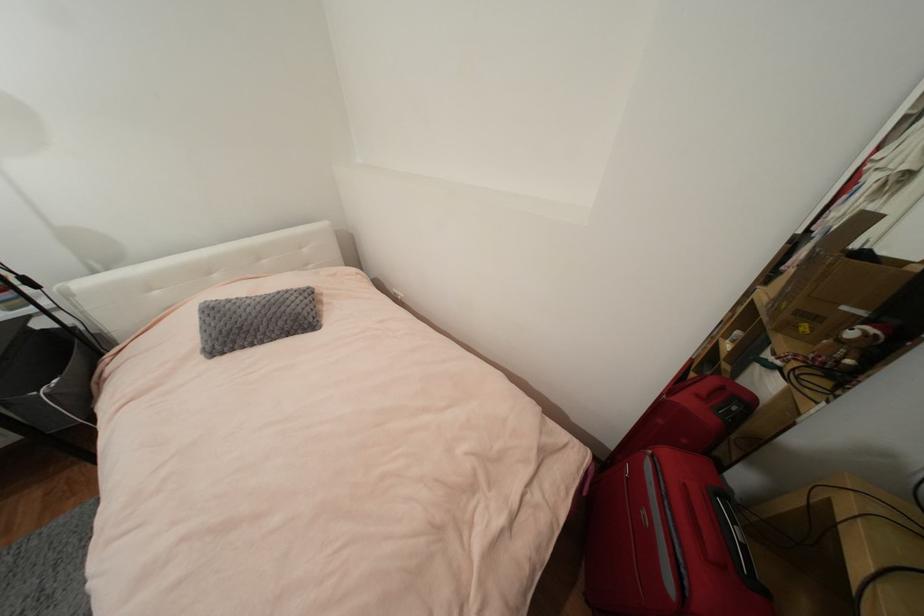
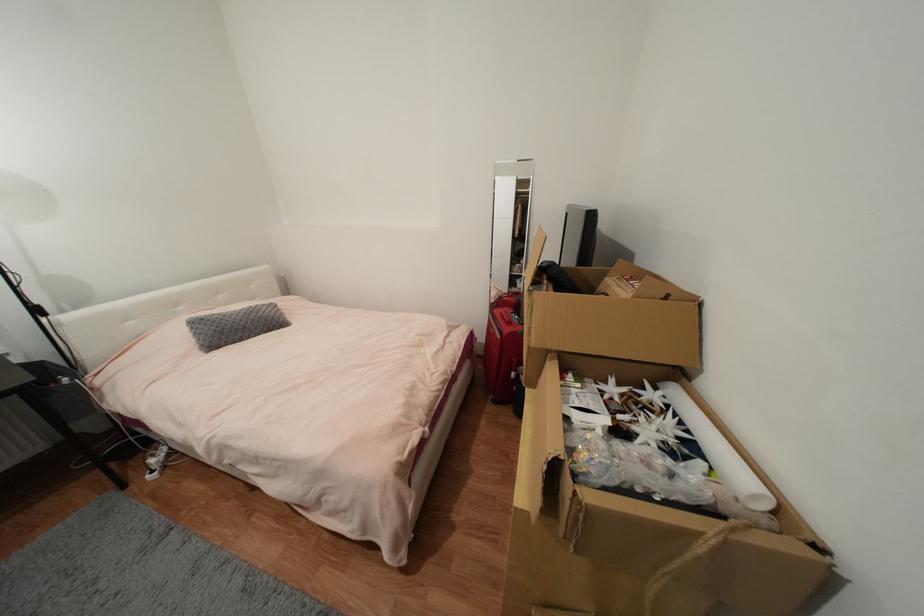
Locate, in the second image, the point that corresponds to [258,314] in the first image.

(244, 320)